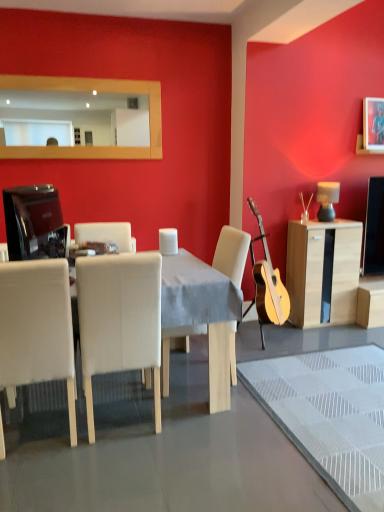
Locate an element on the screen. Image resolution: width=384 pixels, height=512 pixels. free point above wooden frame mirror at upper center (from a real-world perspective) is located at coordinates (74, 78).